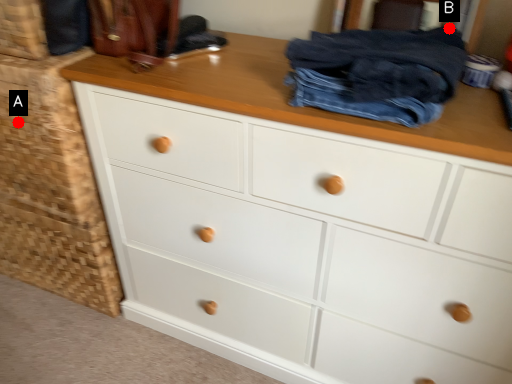
Question: Two points are circled on the image, labeled by A and B beside each circle. Which point appears farthest from the camera in this image?

Choices:
 (A) A is further
 (B) B is further

Answer: (A)